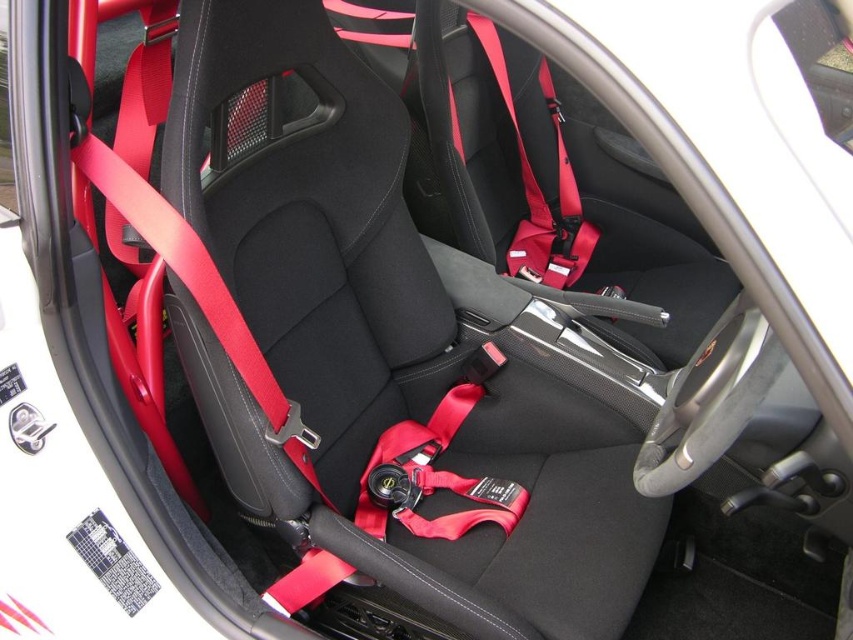
Can you confirm if matte red seatbelt at center is positioned below matte red seatbelt at upper right?

Indeed, matte red seatbelt at center is positioned under matte red seatbelt at upper right.

Which is in front, point (320, 552) or point (549, 272)?

Positioned in front is point (320, 552).

Locate an element on the screen. matte red seatbelt at center is located at coordinates (434, 468).